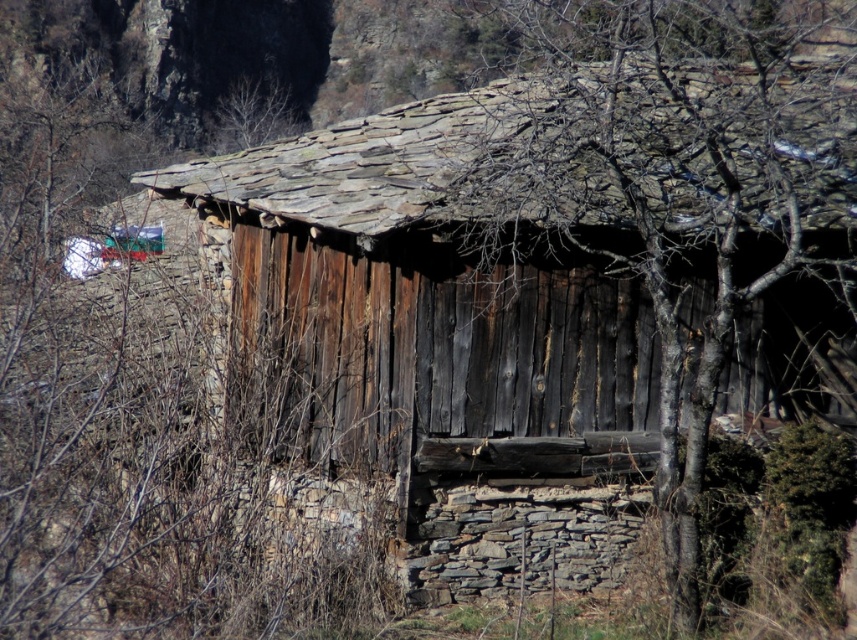
You are standing in front of the old wooden structure and want to determine which of the two points, point (697, 208) or point (231, 120), is closer to you. Based on the structure and its surroundings, which point is nearer?

Point (697, 208) is closer to the viewer than point (231, 120).

Looking at the old wooden structure and its surroundings, which object among the brown rough bark tree at upper left and the bare branches at upper center is larger in size?

The brown rough bark tree at upper left is bigger than the bare branches at upper center.